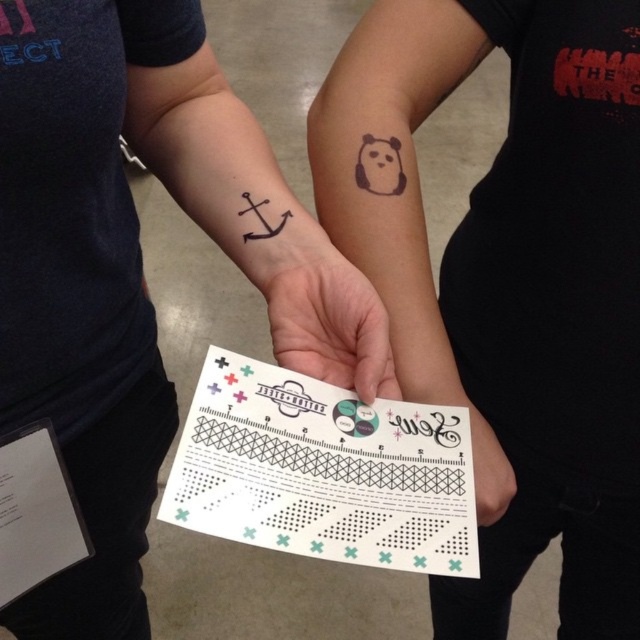
Can you confirm if matte black panda at upper center is positioned to the right of white paper at center?

No, matte black panda at upper center is not to the right of white paper at center.

Identify the location of matte black panda at upper center. (401, 195).

At what (x,y) coordinates should I click in order to perform the action: click on matte black panda at upper center. Please return your answer as a coordinate pair (x, y). The width and height of the screenshot is (640, 640). Looking at the image, I should click on 401,195.

Between point (72, 97) and point (275, 337), which one is positioned in front?

Positioned in front is point (72, 97).

Can you confirm if black ink anchor at upper left is positioned above white matte paper at center?

Actually, black ink anchor at upper left is below white matte paper at center.

Is point (99, 604) farther from camera compared to point (288, 308)?

Yes, point (99, 604) is farther from viewer.

Image resolution: width=640 pixels, height=640 pixels. In order to click on black ink anchor at upper left in this screenshot , I will do (x=136, y=268).

Is matte black panda at upper center bigger than white matte paper at center?

Yes.

Is point (362, 120) positioned behind point (330, 284)?

Yes, it is behind point (330, 284).

Which is in front, point (458, 403) or point (284, 323)?

Positioned in front is point (284, 323).

The width and height of the screenshot is (640, 640). Find the location of `matte black panda at upper center`. matte black panda at upper center is located at coordinates click(x=401, y=195).